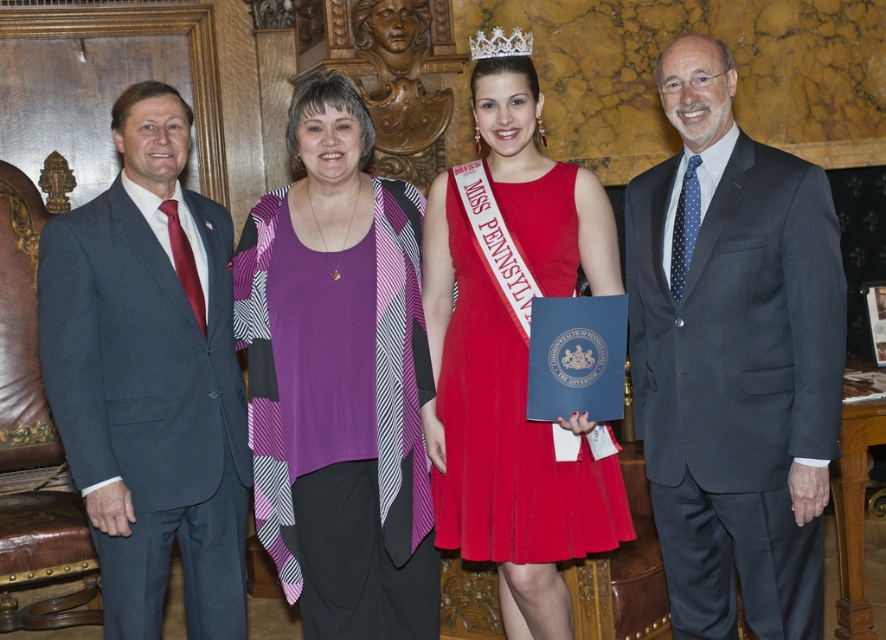
Is dark gray suit at right thinner than red satin dress at center?

Indeed, dark gray suit at right has a lesser width compared to red satin dress at center.

Can you confirm if dark gray suit at right is positioned to the left of red satin dress at center?

In fact, dark gray suit at right is to the right of red satin dress at center.

Who is more distant from viewer, [739,177] or [570,508]?

Positioned behind is point [570,508].

The image size is (886, 640). What are the coordinates of `dark gray suit at right` in the screenshot? It's located at [x=734, y=358].

Does dark blue suit at left appear over red satin dress at center?

No, dark blue suit at left is not above red satin dress at center.

Who is more forward, (x=74, y=349) or (x=449, y=468)?

Point (x=74, y=349) is more forward.

Locate an element on the screen. dark blue suit at left is located at coordinates (150, 378).

Does purple knit top at center have a larger size compared to red satin dress at center?

Correct, purple knit top at center is larger in size than red satin dress at center.

Which of these two, purple knit top at center or red satin dress at center, stands shorter?

Standing shorter between the two is red satin dress at center.

Is point (432, 554) more distant than point (517, 342)?

Yes.

The height and width of the screenshot is (640, 886). In order to click on purple knit top at center in this screenshot , I will do `click(340, 380)`.